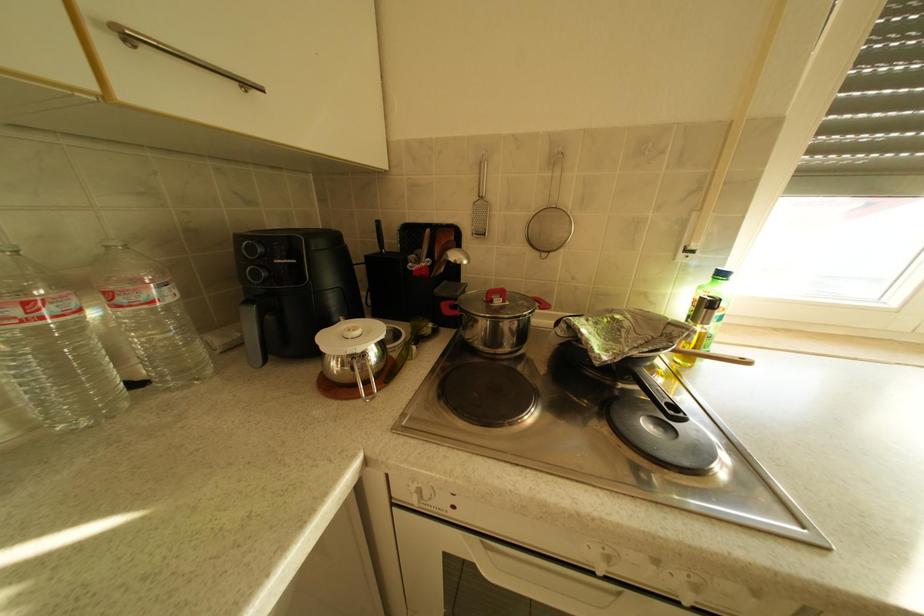
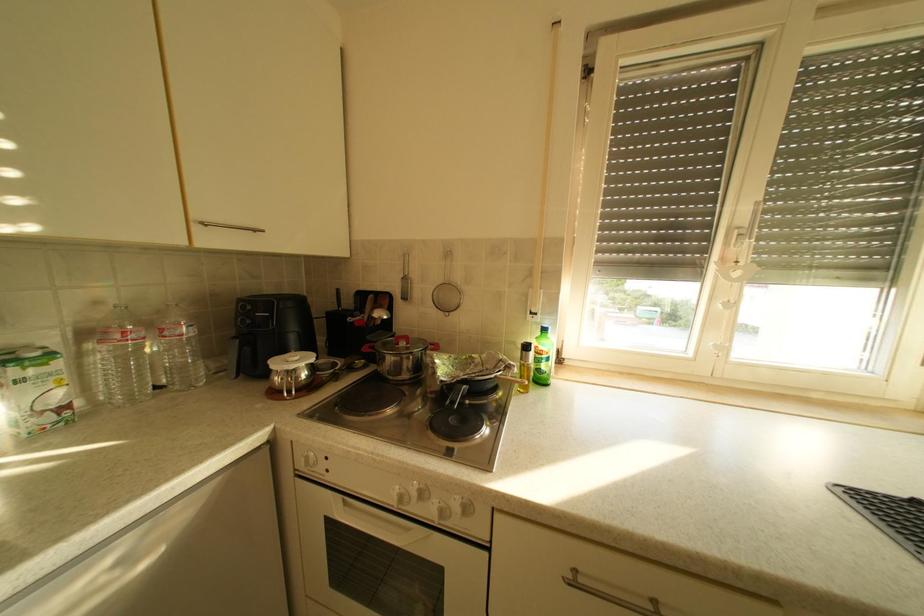
The images are taken continuously from a first-person perspective. In which direction are you moving?

The movement direction of the cameraman is right, backward.